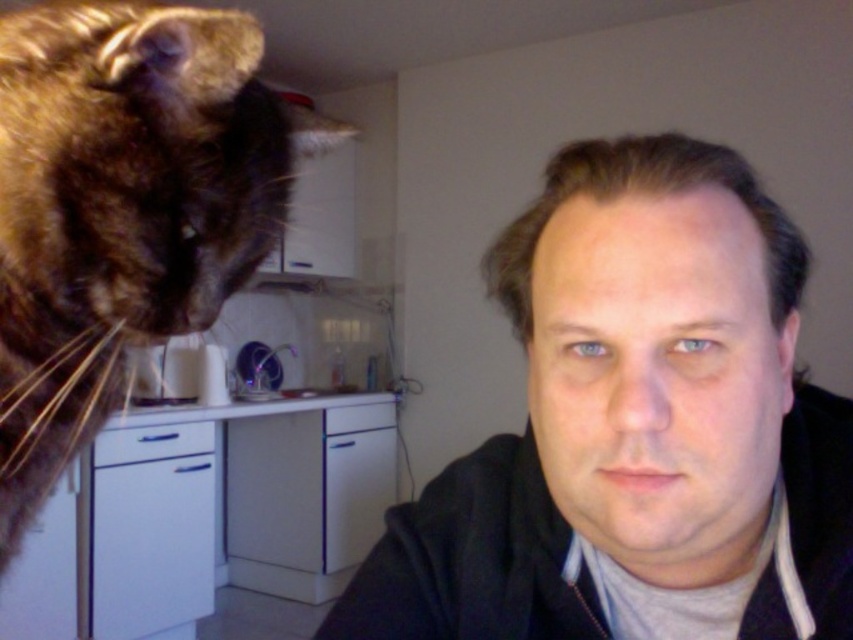
The image size is (853, 640). Describe the element at coordinates (635, 428) in the screenshot. I see `matte black jacket at center` at that location.

Does matte black jacket at center have a greater height compared to brown fur cat at upper left?

No.

Does point (769, 301) come closer to viewer compared to point (106, 4)?

Yes.

The image size is (853, 640). In order to click on matte black jacket at center in this screenshot , I will do `click(635, 428)`.